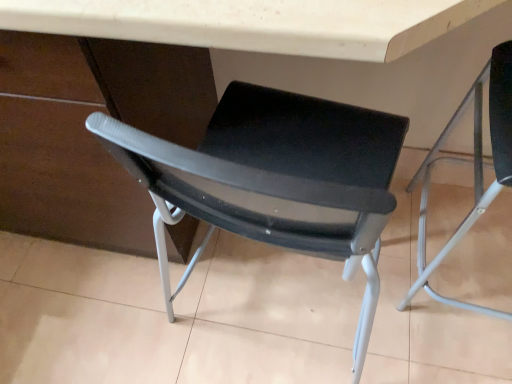
Where is `free space above black mesh chair at center, which appears as the 1th chair when viewed from the left (from a real-world perspective)`? The image size is (512, 384). free space above black mesh chair at center, which appears as the 1th chair when viewed from the left (from a real-world perspective) is located at coordinates (261, 304).